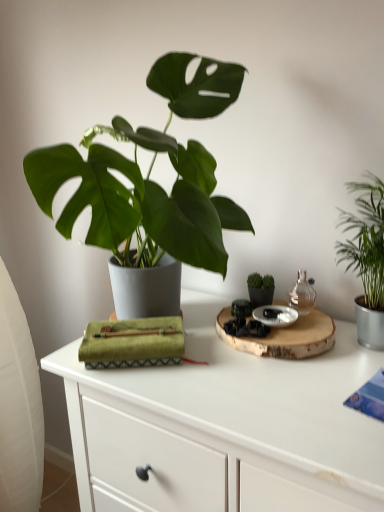
Question: Is green leafy plant at right taller or shorter than white matte table at center?

Choices:
 (A) short
 (B) tall

Answer: (A)

Question: From a real-world perspective, is green leafy plant at right physically located above or below white matte table at center?

Choices:
 (A) above
 (B) below

Answer: (A)

Question: Which object is positioned farthest from the matte black pot at center?

Choices:
 (A) white matte table at center
 (B) green leafy plant at right
 (C) transparent glass bottle at upper right

Answer: (A)

Question: Which of these objects is positioned farthest from the green leafy plant at right?

Choices:
 (A) matte black pot at center
 (B) transparent glass bottle at upper right
 (C) white matte table at center

Answer: (C)